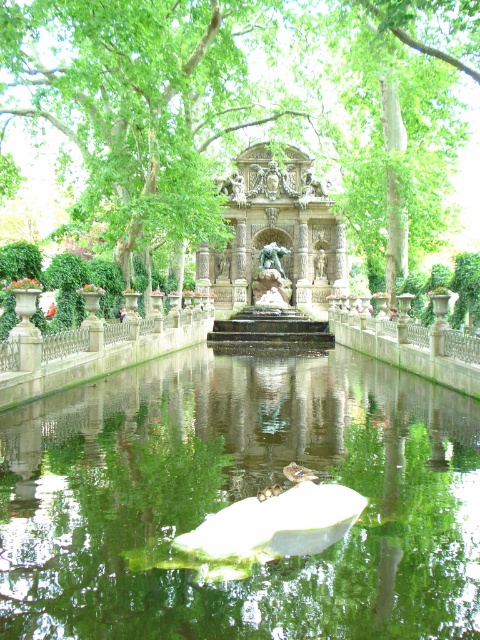
Question: Does bronze sculpture at center appear over polished bronze statue at center?

Choices:
 (A) yes
 (B) no

Answer: (A)

Question: Among these points, which one is farthest from the camera?

Choices:
 (A) (264, 314)
 (B) (276, 161)
 (C) (448, 64)

Answer: (B)

Question: Does bronze statue at center have a larger size compared to polished bronze statue at center?

Choices:
 (A) yes
 (B) no

Answer: (A)

Question: Which object is farther from the camera taking this photo?

Choices:
 (A) polished bronze statue at center
 (B) green reflective water at center
 (C) bronze statue at center
 (D) green leafy tree at center

Answer: (A)

Question: Can you confirm if green reflective water at center is positioned above green leafy tree at center?

Choices:
 (A) yes
 (B) no

Answer: (B)

Question: Which point appears farthest from the camera in this image?

Choices:
 (A) (220, 42)
 (B) (420, 413)
 (C) (274, 253)
 (D) (240, 346)

Answer: (C)